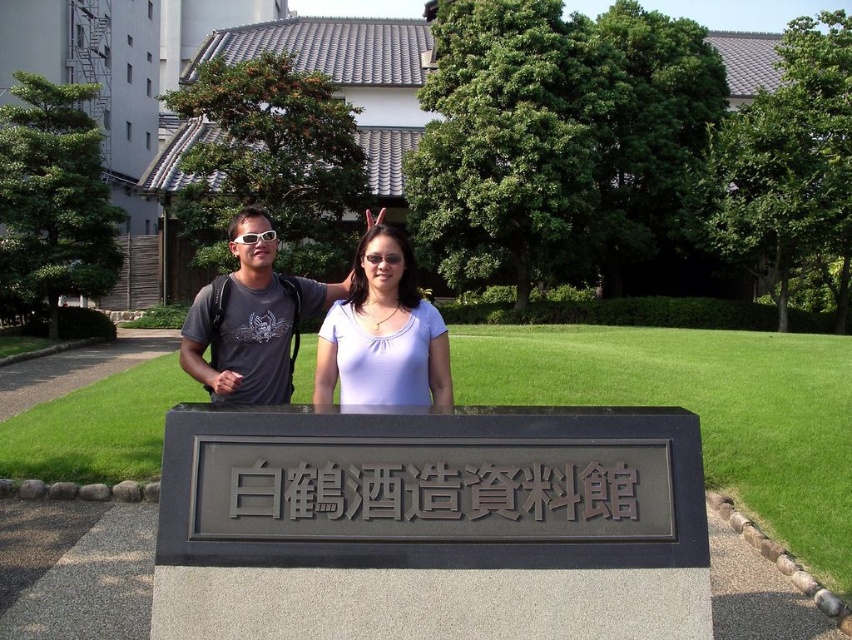
Question: Estimate the real-world distances between objects in this image. Which object is closer to the black metal sign at center?

Choices:
 (A) matte black t-shirt at center
 (B) purple matte shirt at center

Answer: (B)

Question: Does black metal sign at center lie behind matte black t-shirt at center?

Choices:
 (A) yes
 (B) no

Answer: (B)

Question: Based on their relative distances, which object is nearer to the matte black t-shirt at center?

Choices:
 (A) purple matte shirt at center
 (B) black metal sign at center

Answer: (A)

Question: Which point is closer to the camera?

Choices:
 (A) black metal sign at center
 (B) purple matte shirt at center

Answer: (A)

Question: Is black metal sign at center further to the viewer compared to matte black t-shirt at center?

Choices:
 (A) yes
 (B) no

Answer: (B)

Question: Does purple matte shirt at center have a lesser width compared to matte black t-shirt at center?

Choices:
 (A) no
 (B) yes

Answer: (A)